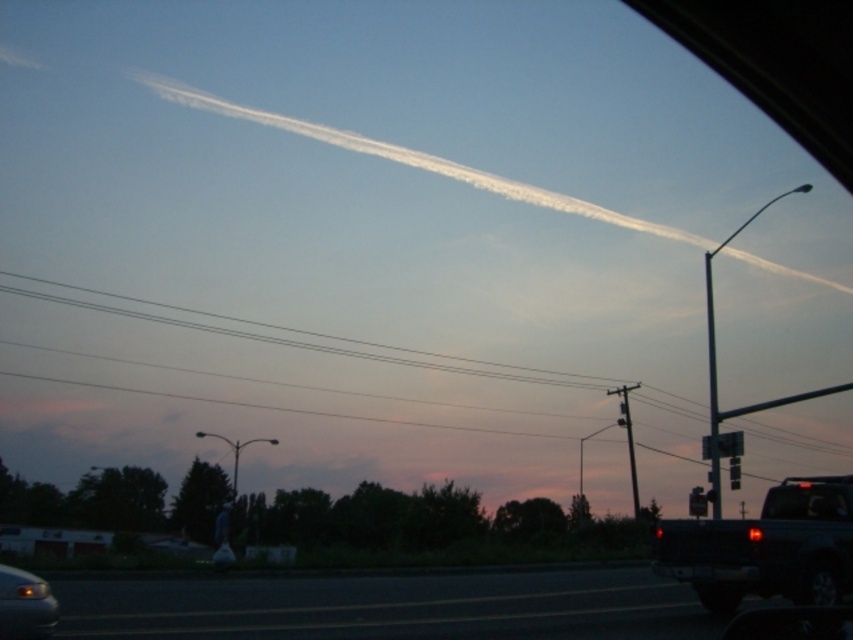
You are a pedestrian standing on the road and see the matte black truck at lower right and the matte black car at lower left. Which vehicle is closer to you?

The matte black truck at lower right is taller than the matte black car at lower left, so it is closer to you because objects closer appear larger in size.

You are a pedestrian standing on the sidewalk next to the road. You see a matte black truck at lower right and a matte black car at lower left. Which vehicle is closer to you?

The matte black truck at lower right is closer to you because the matte black car at lower left is behind it.

You are a delivery driver navigating a route at dusk. You see the matte black truck at lower right ahead on the road. If your GPS shows that the nearest gas station is located at coordinate point 0.9, 0.9, would you need to adjust your route to reach it?

The matte black truck at lower right is located at coordinate point (766, 547), which is very close to the gas station at (767, 576). Since the truck is near but not exactly at the gas station coordinates, you may need to make a slight adjustment to your route to reach the gas station, ensuring you avoid the truck and navigate safely to the destination.